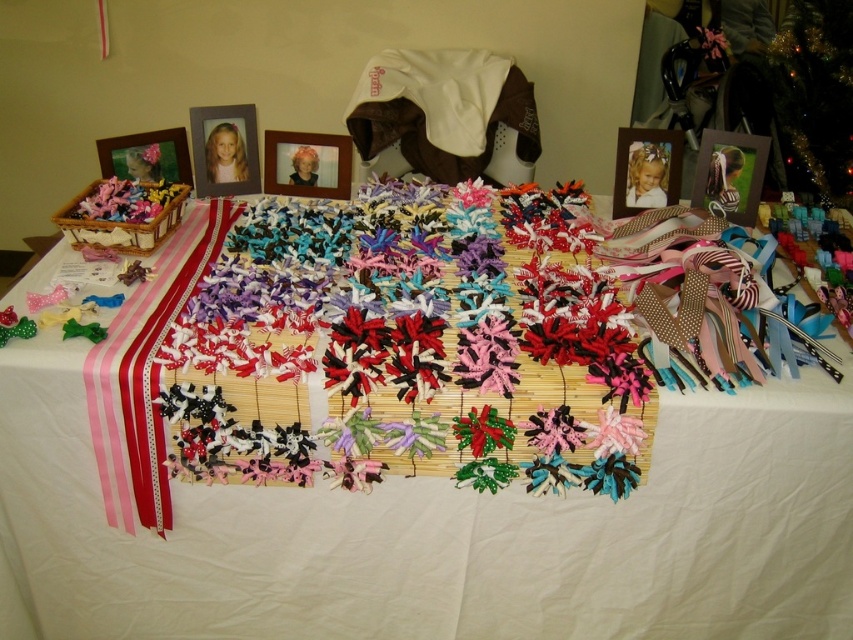
You are a customer at a craft store looking to purchase a hair accessory. You see the multicolored fabric bows at center and the matte plastic picture frame at upper left. Which item is wider?

The multicolored fabric bows at center might be wider than the matte plastic picture frame at upper left, so it is possible that the multicolored fabric bows at center are wider.

Based on the photo, you are standing at the edge of the table and see the point marked as point (466, 534). Which object is closest to this point?

The white fabric at center is closest to point (466, 534).

You are a customer at a hair accessory store and want to place a new order. The store requires that the distance between the multicolored fabric bows at center and the wicker basket on the left must be at least 4 feet. Can you determine if the current arrangement meets this requirement?

The multicolored fabric bows at center and the wicker basket on the left are 3.70 feet apart, which is less than the required 4 feet. Therefore, the current arrangement does not meet the store requirement.